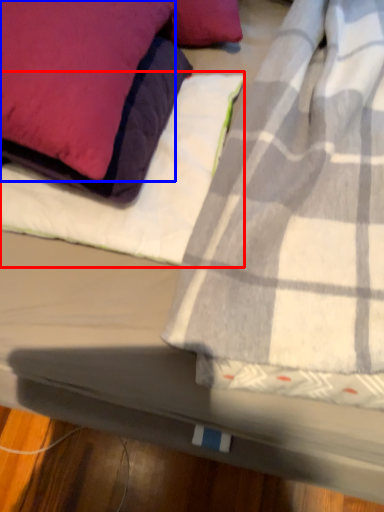
Question: Which object appears farthest to the camera in this image, sheet (highlighted by a red box) or pillow (highlighted by a blue box)?

Choices:
 (A) sheet
 (B) pillow

Answer: (A)